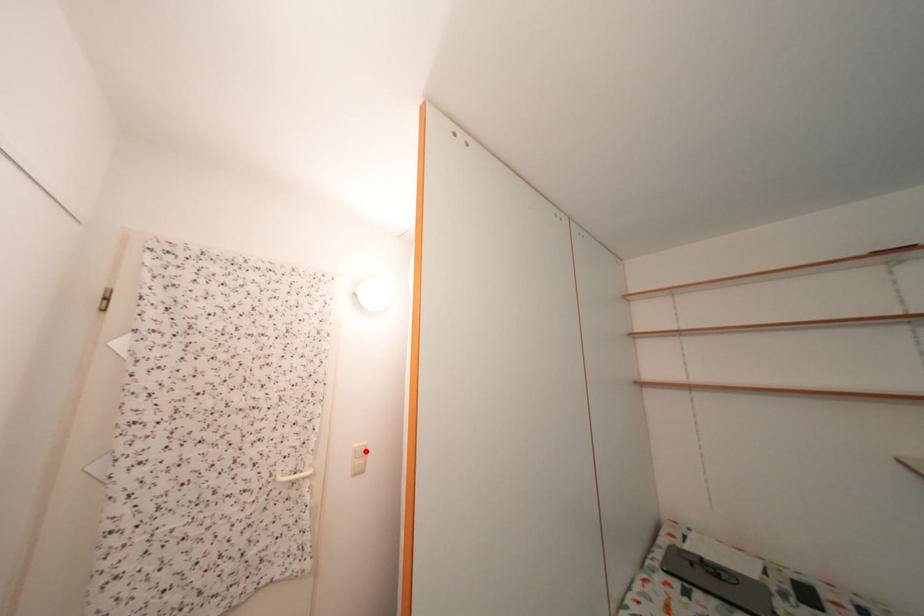
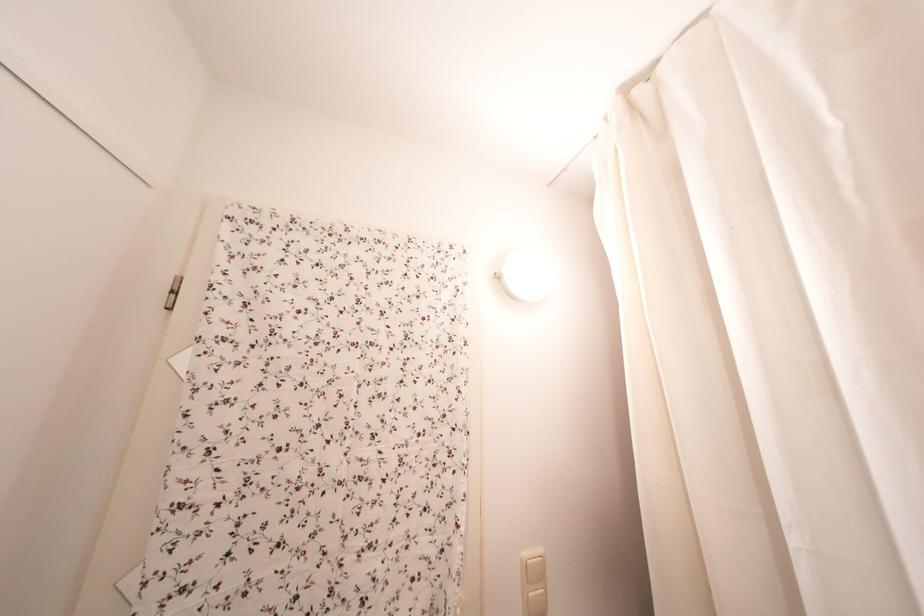
Where in the second image is the point corresponding to the highlighted location from the first image?

(536, 560)